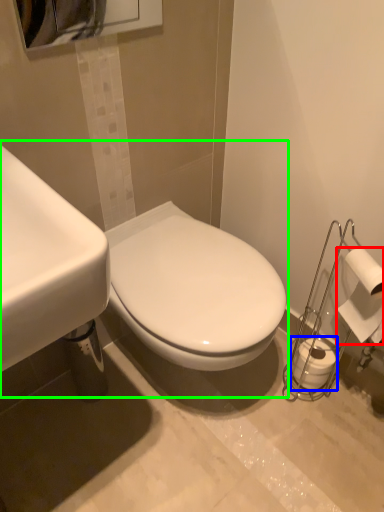
Question: Which object is positioned farthest from toilet paper (highlighted by a red box)? Select from toilet paper (highlighted by a blue box) and sink (highlighted by a green box).

Choices:
 (A) toilet paper
 (B) sink

Answer: (B)